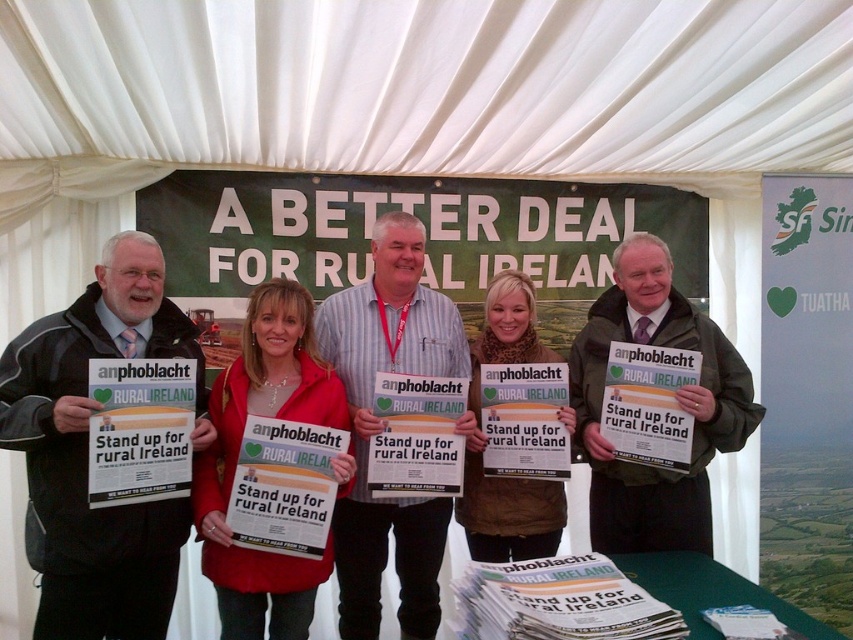
You are standing in front of the tent and want to find the black jacket at left. Based on the coordinates provided, in which direction should you look relative to the center of the tent?

The black jacket at left is located at coordinates point (86, 452), which places it to the lower left side of the tent. Therefore, you should look towards the lower left direction relative to the center of the tent.

You are a photographer at the event and want to take a photo of the striped shirt at center and the red jacket at center. Which one is positioned to the right of the other?

The striped shirt at center is to the right of the red jacket at center.